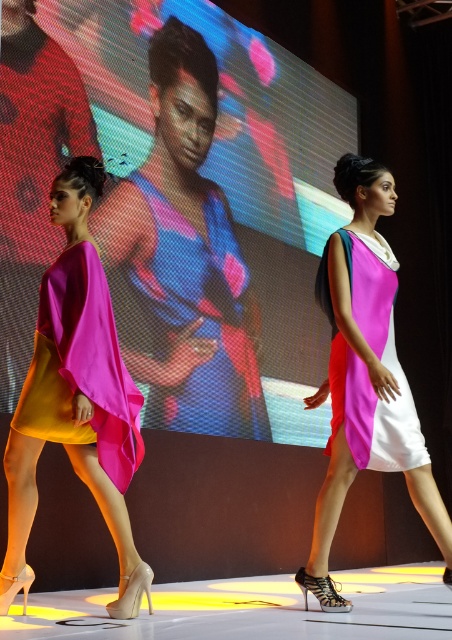
Question: Which of these objects is positioned closest to the matte blue dress at center?

Choices:
 (A) pink satin dress at center
 (B) silky satin dress at center

Answer: (B)

Question: Does pink satin dress at left have a lesser width compared to matte satin dress at left?

Choices:
 (A) no
 (B) yes

Answer: (A)

Question: Does matte blue dress at center lie in front of matte satin dress at left?

Choices:
 (A) no
 (B) yes

Answer: (A)

Question: Which object appears farthest from the camera in this image?

Choices:
 (A) pink satin dress at left
 (B) shiny metallic shoes at center

Answer: (A)

Question: Which object is the closest to the matte blue dress at center?

Choices:
 (A) pink satin dress at left
 (B) matte satin dress at left

Answer: (A)

Question: Considering the relative positions of pink satin dress at left and pink satin dress at center in the image provided, where is pink satin dress at left located with respect to pink satin dress at center?

Choices:
 (A) right
 (B) left

Answer: (B)